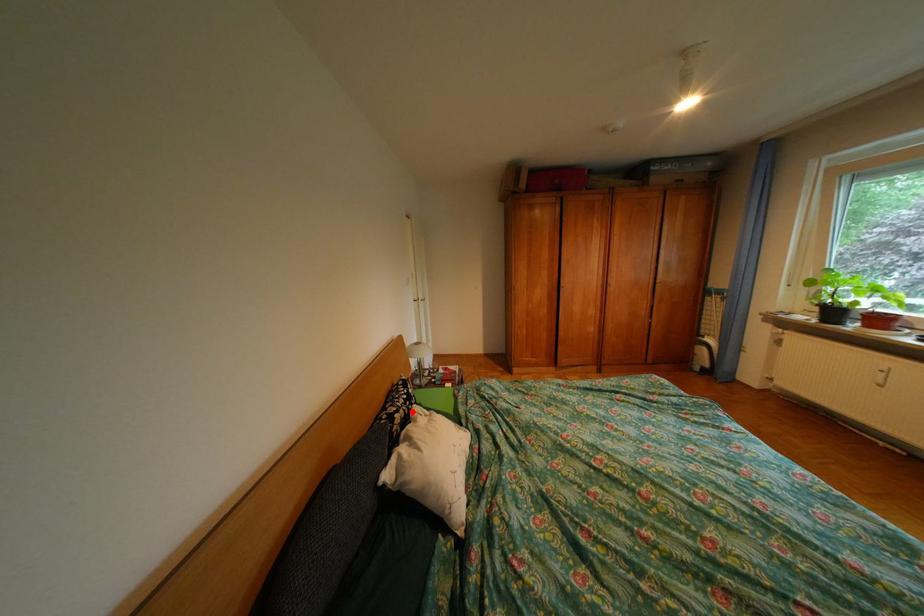
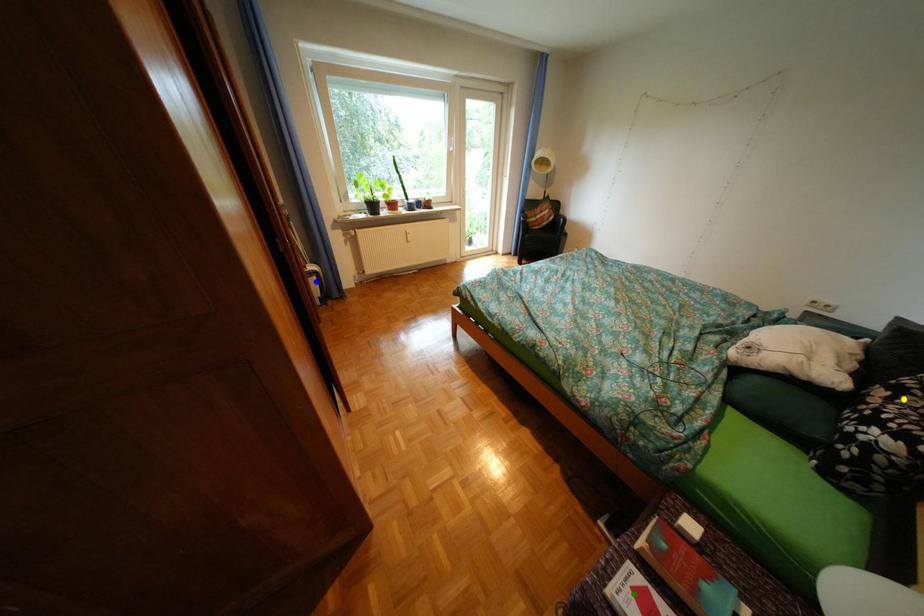
Question: I am providing you with two images of the same scene from different viewpoints. A red point is marked on the first image. You are given multiple points on the second image. Which point in image 2 represents the same 3d spot as the red point in image 1?

Choices:
 (A) green point
 (B) yellow point
 (C) blue point

Answer: (B)